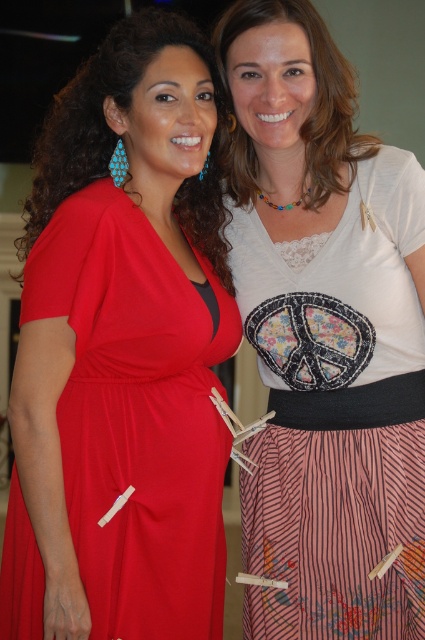
You are a photographer adjusting your camera settings to focus on the woman wearing the matte red dress at left. The camera has a focus grid that shows coordinates from 0 to 1 on both the x and y axes. According to the scene, what are the coordinates where you should aim the focus point?

The coordinates for the matte red dress at left are at point (121, 355), so you should aim the focus point at those coordinates.

You are a photographer adjusting your camera settings. You notice the matte red dress at left and the white lace top at center in your frame. Which clothing item should you focus on first to ensure it is in sharp focus?

The matte red dress at left is closer to the viewer than the white lace top at center, so focusing on it first will ensure it is in sharp focus before adjusting for the background.